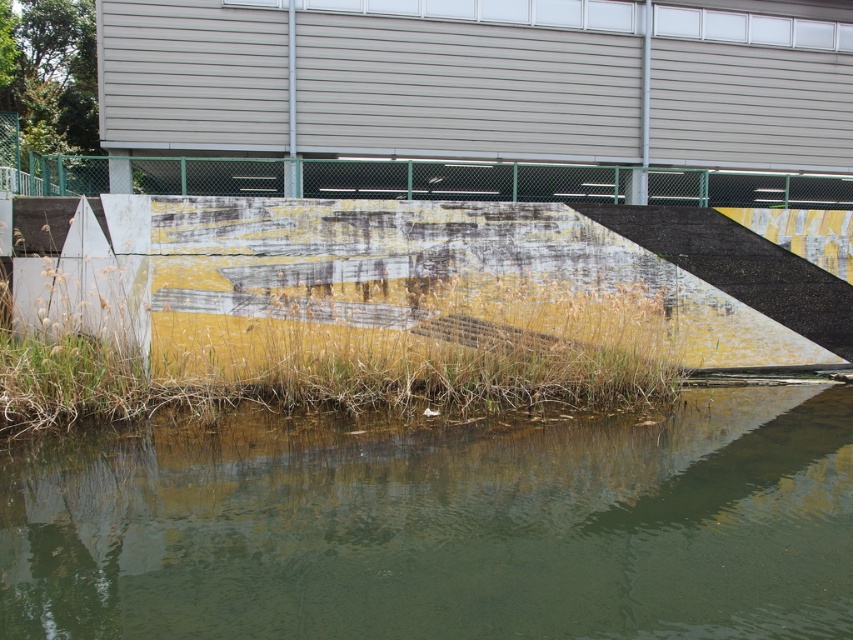
You are standing at the center of the image. Which direction should you move to reach the green matte water at lower center?

The green matte water at lower center is located at point coordinates of (442,528). Since you are at the center, you should move towards the lower right direction to reach it.